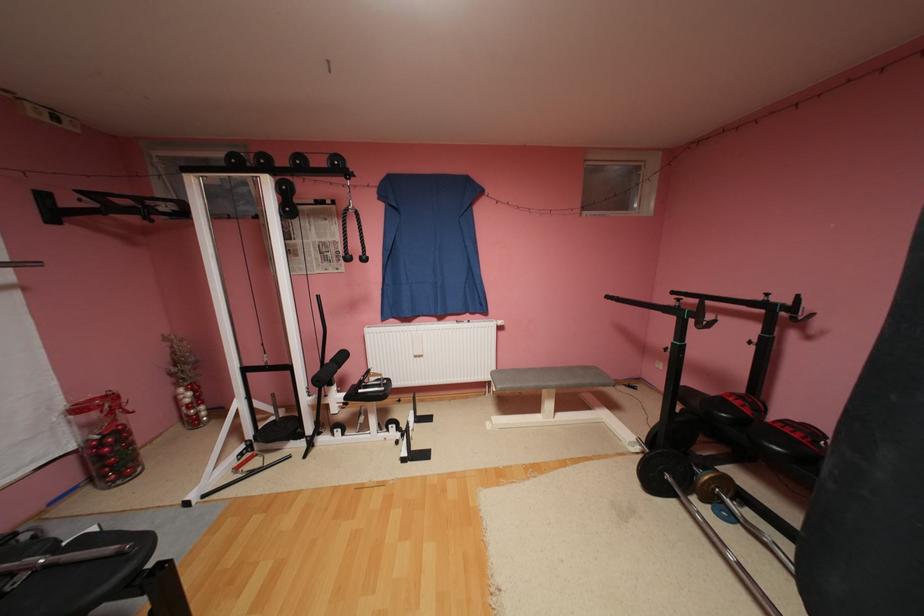
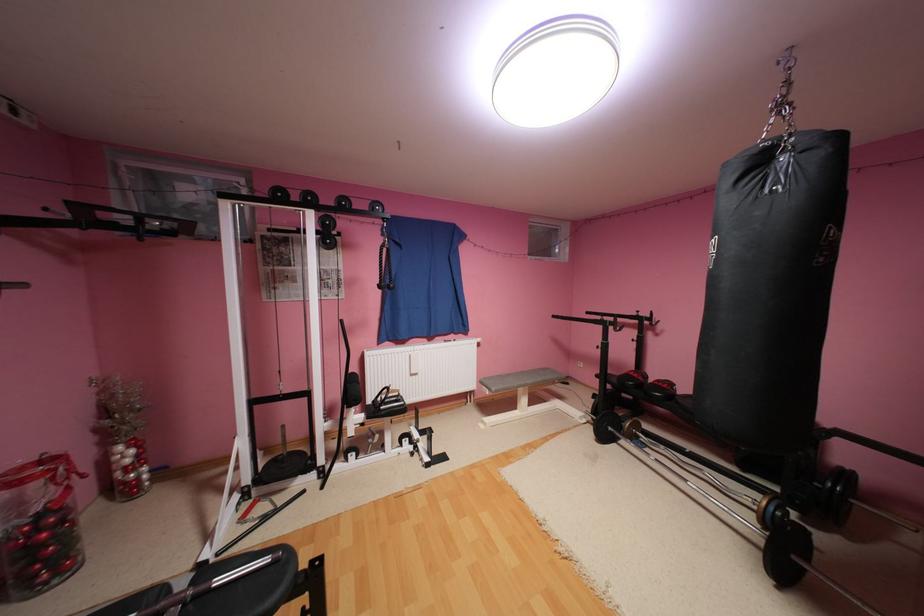
The point at (647, 448) is marked in the first image. Where is the corresponding point in the second image?

(593, 419)